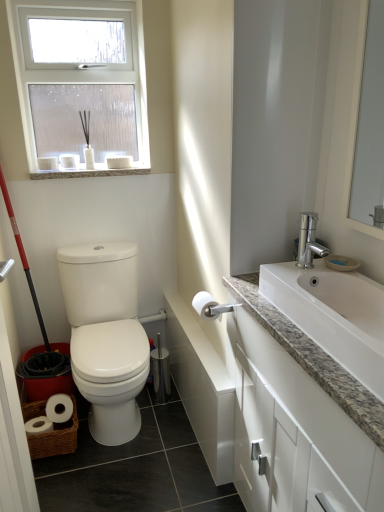
The width and height of the screenshot is (384, 512). I want to click on vacant area on top of white glossy toilet paper at center (from a real-world perspective), so click(x=195, y=334).